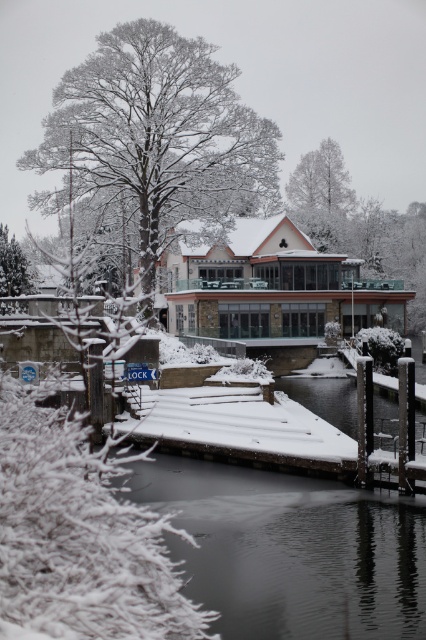
Can you confirm if snow-covered tree at upper center is shorter than white frosty tree at upper center?

Incorrect, snow-covered tree at upper center's height does not fall short of white frosty tree at upper center's.

Image resolution: width=426 pixels, height=640 pixels. I want to click on snow-covered tree at upper center, so click(x=158, y=134).

Who is more distant from viewer, (x=244, y=205) or (x=347, y=195)?

The point (x=347, y=195) is more distant.

At what (x,y) coordinates should I click in order to perform the action: click on snow-covered tree at upper center. Please return your answer as a coordinate pair (x, y). Looking at the image, I should click on (158, 134).

Does smooth ice river at lower center have a smaller size compared to green matte tree at upper left?

Indeed, smooth ice river at lower center has a smaller size compared to green matte tree at upper left.

Can you confirm if smooth ice river at lower center is thinner than green matte tree at upper left?

Indeed, smooth ice river at lower center has a lesser width compared to green matte tree at upper left.

The image size is (426, 640). What are the coordinates of `smooth ice river at lower center` in the screenshot? It's located at (290, 550).

Between snow-covered tree at upper center and green matte tree at upper left, which one is positioned lower?

Positioned lower is green matte tree at upper left.

Measure the distance between point (x=255, y=179) and camera.

Point (x=255, y=179) and camera are 186.25 feet apart from each other.

Where is `snow-covered tree at upper center`? This screenshot has height=640, width=426. snow-covered tree at upper center is located at coordinates (158, 134).